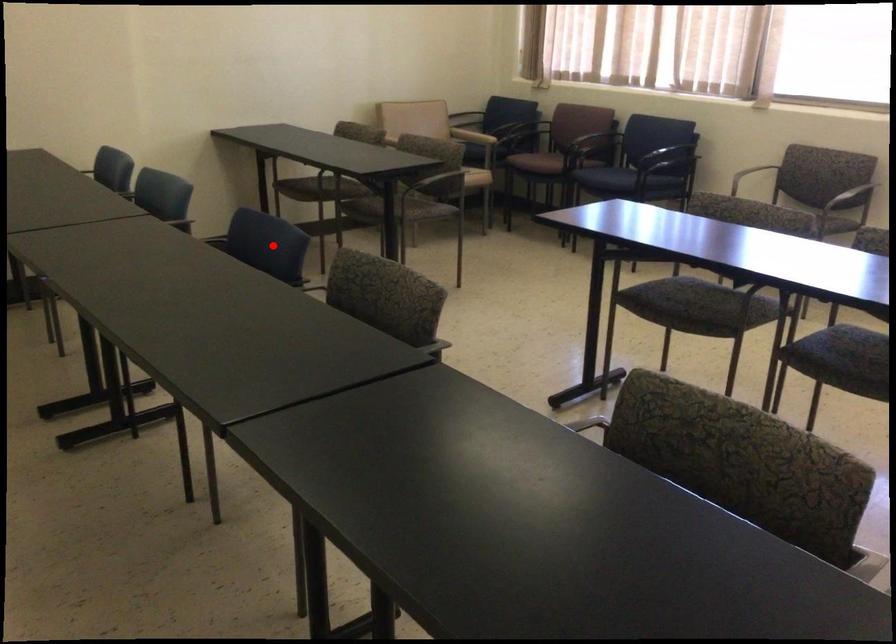
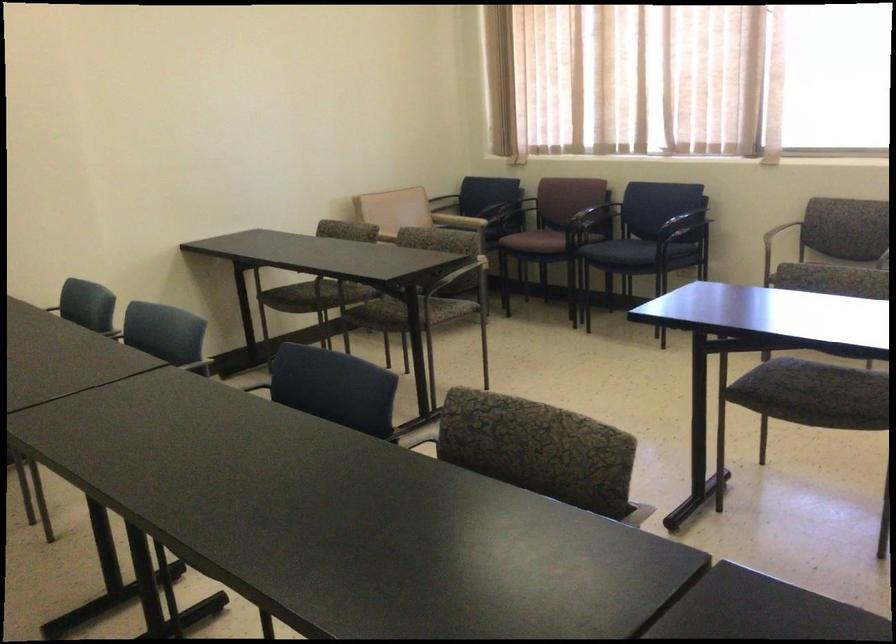
Question: A red point is marked in image1. In image2, is the corresponding 3D point closer to the camera or farther? Reply with the corresponding letter.

Choices:
 (A) The corresponding 3D point is closer.
 (B) The corresponding 3D point is farther.

Answer: (A)